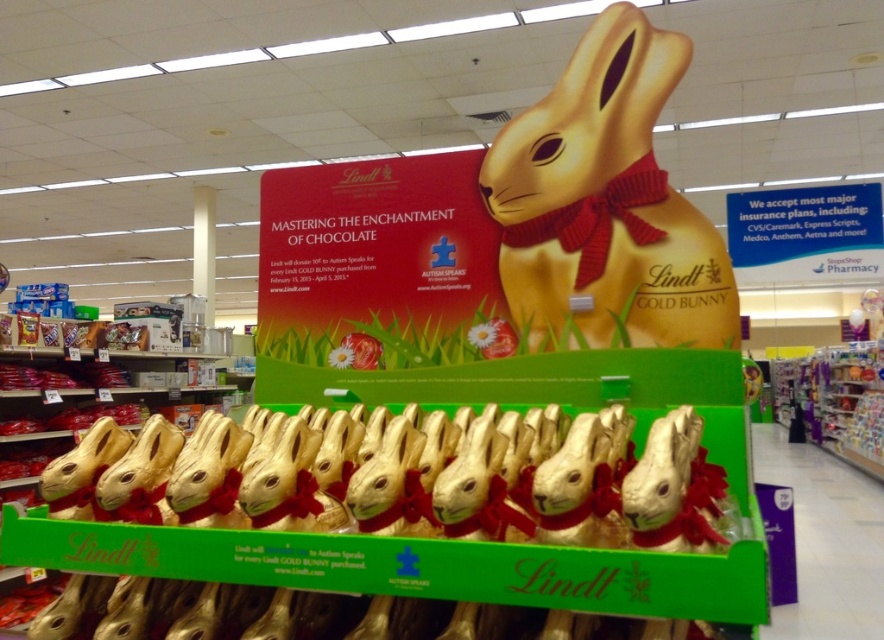
Is gold shiny chocolate bunnies at center to the right of gold shiny bunny at center from the viewer's perspective?

In fact, gold shiny chocolate bunnies at center is to the left of gold shiny bunny at center.

Is gold shiny chocolate bunnies at center to the left of gold shiny bunny at center from the viewer's perspective?

Yes, gold shiny chocolate bunnies at center is to the left of gold shiny bunny at center.

Is point (311, 458) in front of point (635, 116)?

Yes, point (311, 458) is in front of point (635, 116).

Identify the location of gold shiny chocolate bunnies at center. The image size is (884, 640). (473, 477).